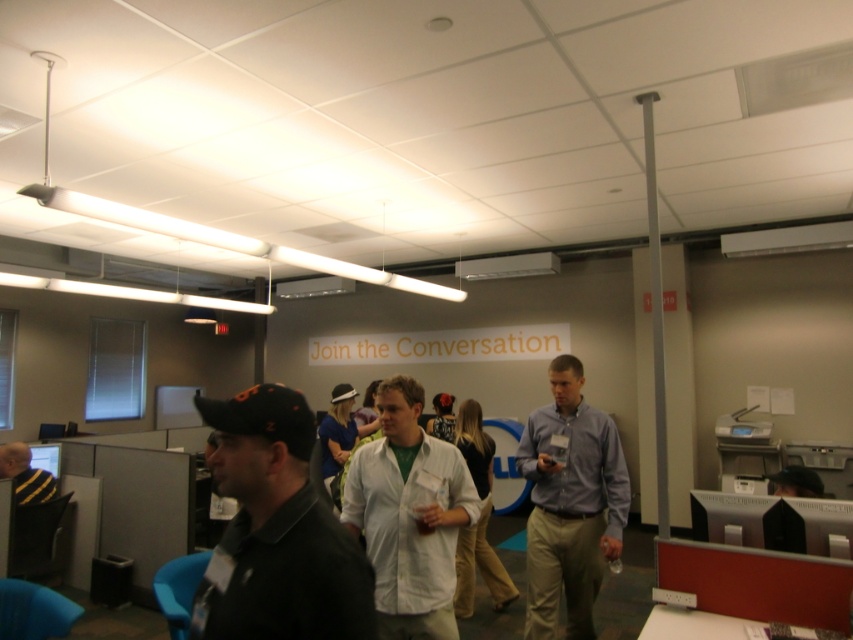
You are an office assistant who needs to place two matte black caps on a shelf. The shelf has a width limit of 12 inches. The matte black cap at upper center and the matte black cap at center are both available. Which cap will fit better on the shelf if you want to leave space for other items?

The matte black cap at center has a smaller width compared to the matte black cap at upper center, so it will fit better on the shelf while leaving more space for other items.

Consider the image. You are standing in the office and want to move from the point at coordinates [566,566] to the point at coordinates [471,540]. Which direction should you move to get closer to your destination?

To move from point [566,566] to point [471,540], you should move backward since point [566,566] is closer to the viewer than point [471,540].

You are an office employee trying to locate your colleague who is wearing a light blue shirt at center. There is also a white cotton shirt at center in the scene. Which direction should you look to find your colleague?

The light blue shirt at center is in front of the white cotton shirt at center, so you should look towards the front direction to find your colleague.